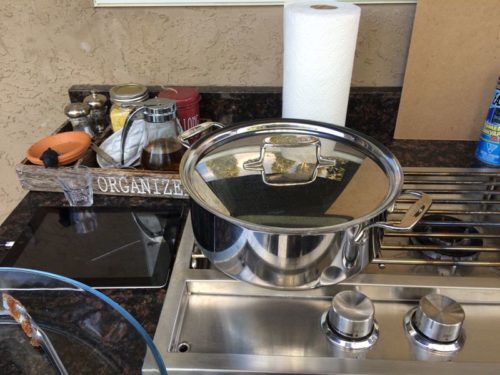
Where is `burner`? The image size is (500, 375). burner is located at coordinates (448, 237).